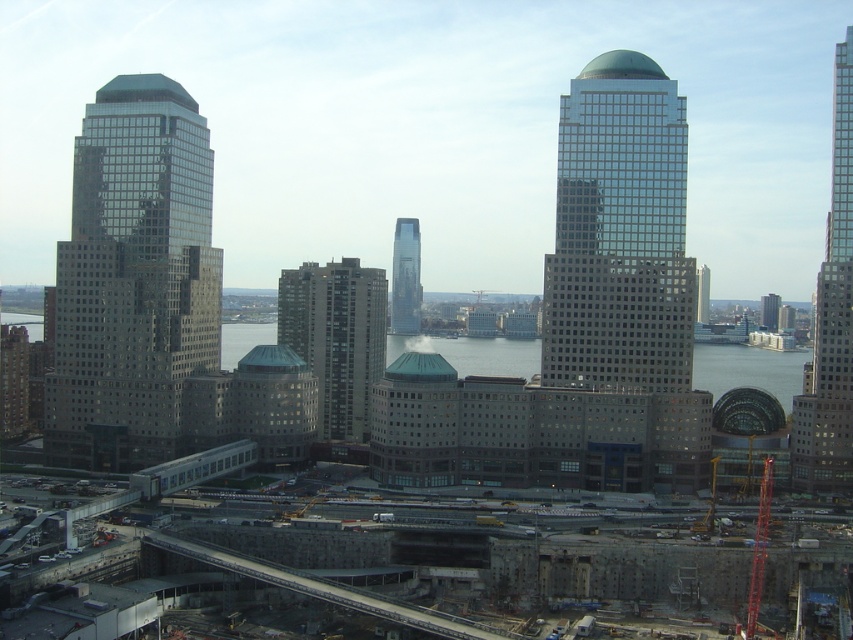
Question: Is shiny glass skyscraper at left further to the viewer compared to glassy steel skyscraper at center?

Choices:
 (A) no
 (B) yes

Answer: (A)

Question: Which point is closer to the camera?

Choices:
 (A) shiny glass skyscraper at left
 (B) dark gray concrete building at center
 (C) glassy steel skyscraper at center
 (D) clear glass skyscraper at center

Answer: (D)

Question: Is shiny glass skyscraper at left in front of dark gray concrete building at center?

Choices:
 (A) yes
 (B) no

Answer: (A)

Question: Which of these objects is positioned closest to the dark gray concrete building at center?

Choices:
 (A) clear glass skyscraper at center
 (B) shiny glass skyscraper at left
 (C) glassy steel skyscraper at right

Answer: (B)

Question: Which object is closer to the camera taking this photo?

Choices:
 (A) shiny glass skyscraper at left
 (B) dark gray concrete building at center

Answer: (A)

Question: Is shiny glass skyscraper at left below glassy steel skyscraper at right?

Choices:
 (A) yes
 (B) no

Answer: (A)